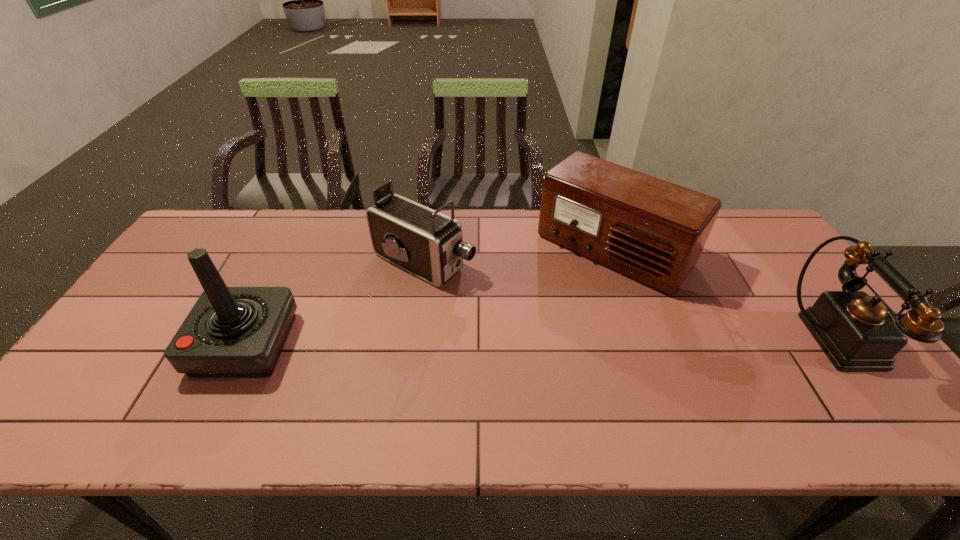
The height and width of the screenshot is (540, 960). Find the location of `free point located at the lens of the camcorder`. free point located at the lens of the camcorder is located at coordinates (549, 320).

Where is `vacant point located on the front-facing side of the radio receiver`? vacant point located on the front-facing side of the radio receiver is located at coordinates (512, 353).

At what (x,y) coordinates should I click in order to perform the action: click on vacant space located on the front-facing side of the radio receiver. Please return your answer as a coordinate pair (x, y). This screenshot has width=960, height=540. Looking at the image, I should click on (528, 336).

I want to click on vacant space located on the front-facing side of the radio receiver, so click(x=542, y=320).

Find the location of `camcorder that is at the far edge`. camcorder that is at the far edge is located at coordinates (428, 244).

The height and width of the screenshot is (540, 960). Identify the location of radio receiver at the far edge. (653, 231).

Image resolution: width=960 pixels, height=540 pixels. Find the location of `joystick at the near edge`. joystick at the near edge is located at coordinates (231, 332).

The height and width of the screenshot is (540, 960). I want to click on telephone at the near edge, so click(856, 332).

Identify the location of object located in the right edge section of the desktop. (856, 332).

The width and height of the screenshot is (960, 540). Identify the location of object present at the near right corner. (856, 332).